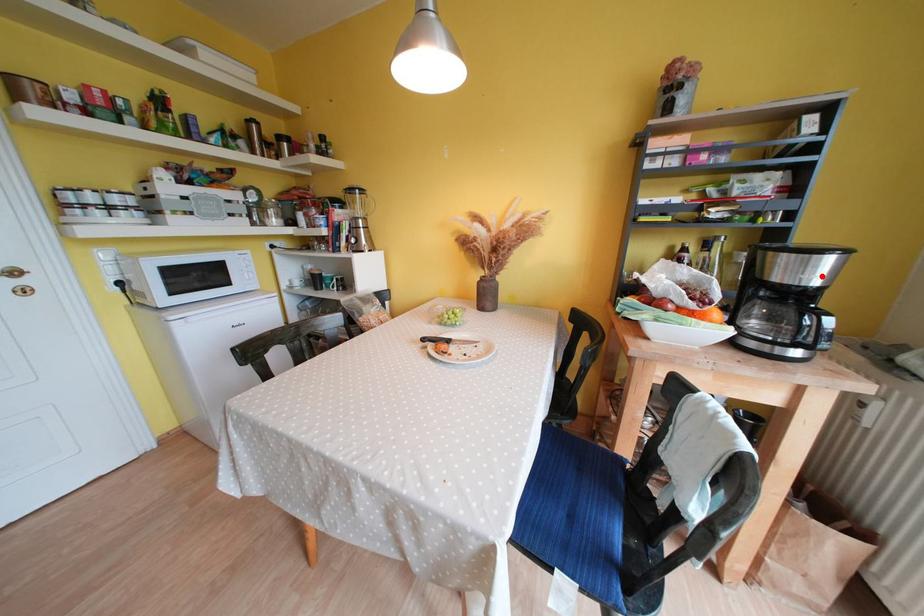
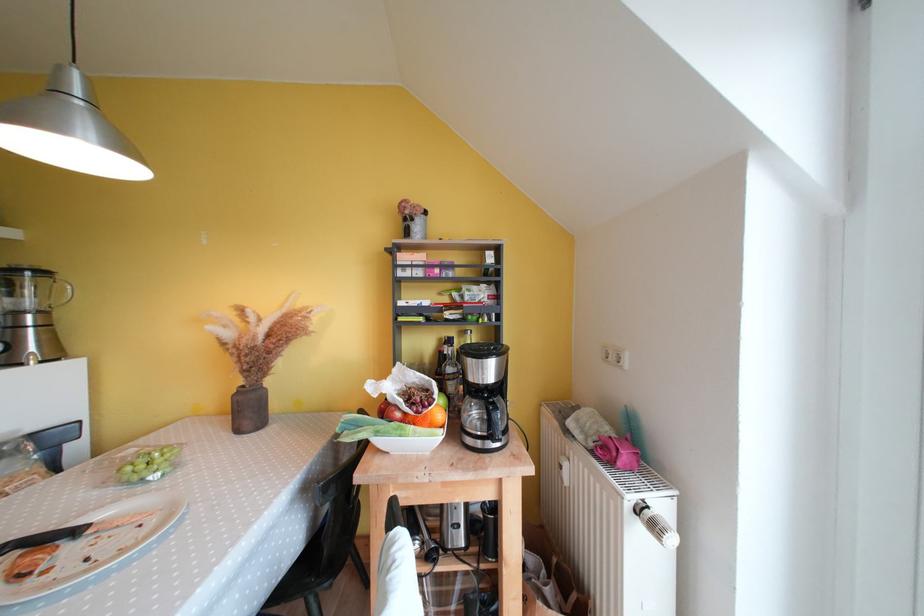
The point at the highlighted location is marked in the first image. Where is the corresponding point in the second image?

(494, 376)